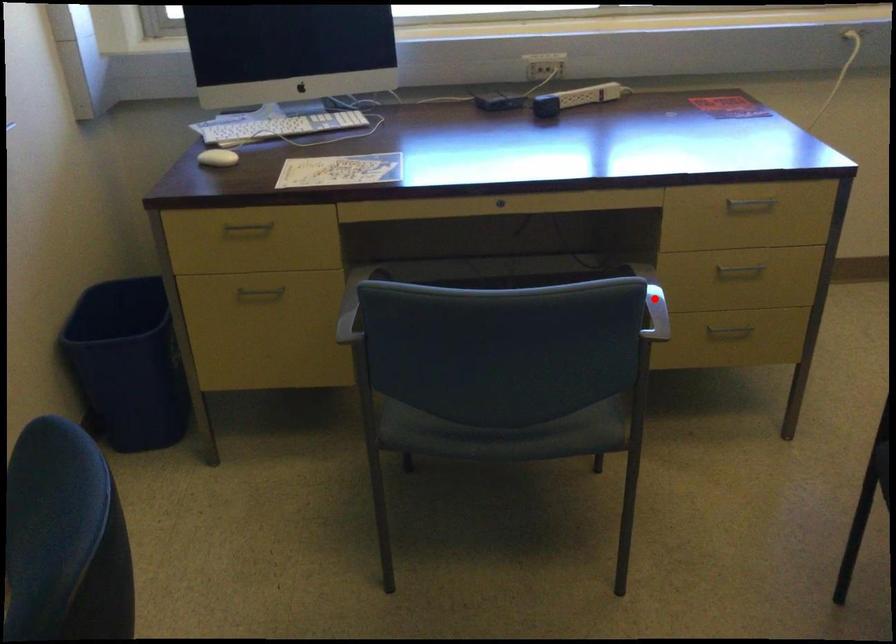
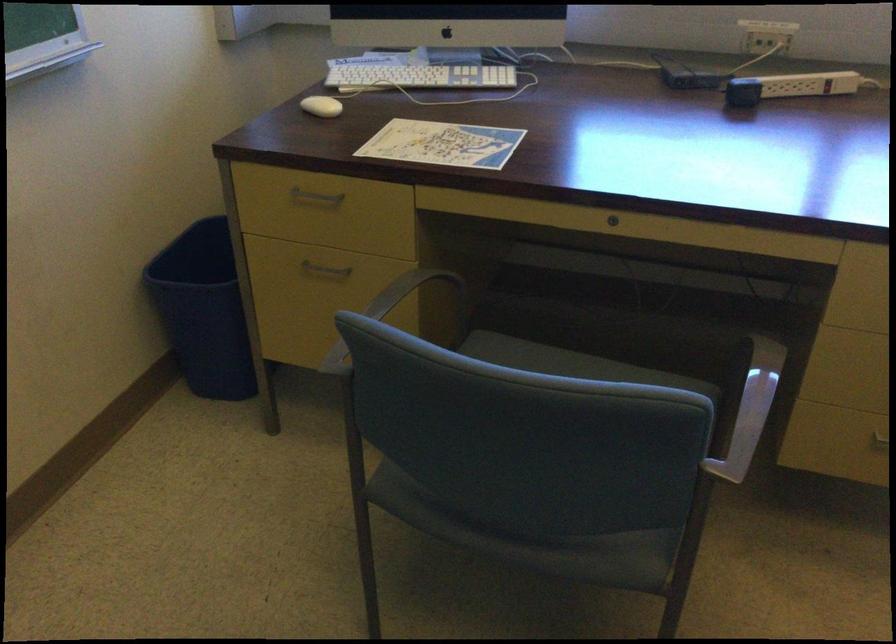
Where in the second image is the point corresponding to the highlighted location from the first image?

(750, 410)